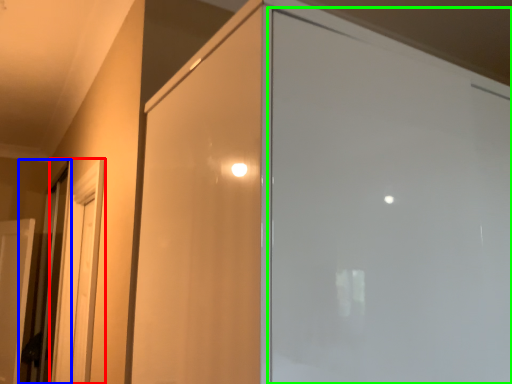
Question: Which object is positioned farthest from screen door (highlighted by a red box)? Select from elevator (highlighted by a blue box) and screen door (highlighted by a green box).

Choices:
 (A) elevator
 (B) screen door

Answer: (B)